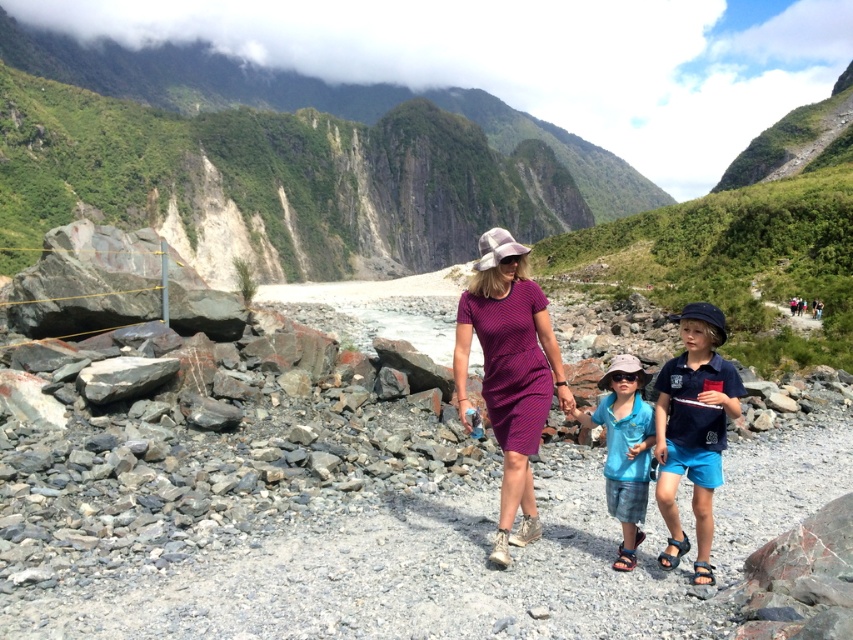
Question: Which point is farther from the camera taking this photo?

Choices:
 (A) (636, 448)
 (B) (18, 115)
 (C) (689, 472)

Answer: (B)

Question: Can you confirm if purple striped dress at center is positioned below blue cotton shirt at center?

Choices:
 (A) yes
 (B) no

Answer: (B)

Question: Can you confirm if blue cotton shirt at center is smaller than blue fabric shorts at center?

Choices:
 (A) yes
 (B) no

Answer: (B)

Question: Estimate the real-world distances between objects in this image. Which object is farther from the blue fabric shorts at center?

Choices:
 (A) purple striped dress at center
 (B) blue cotton shirt at center
 (C) green rock at upper center

Answer: (C)

Question: Does purple striped dress at center come behind blue cotton shirt at center?

Choices:
 (A) yes
 (B) no

Answer: (A)

Question: Which point is farther from the camera taking this photo?

Choices:
 (A) (497, 378)
 (B) (625, 454)

Answer: (A)